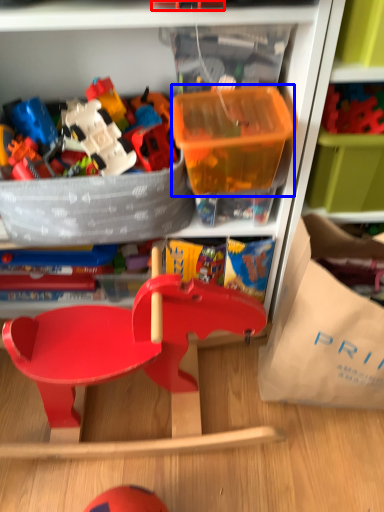
Question: Which point is closer to the camera, toy (highlighted by a red box) or storage box (highlighted by a blue box)?

Choices:
 (A) toy
 (B) storage box

Answer: (A)